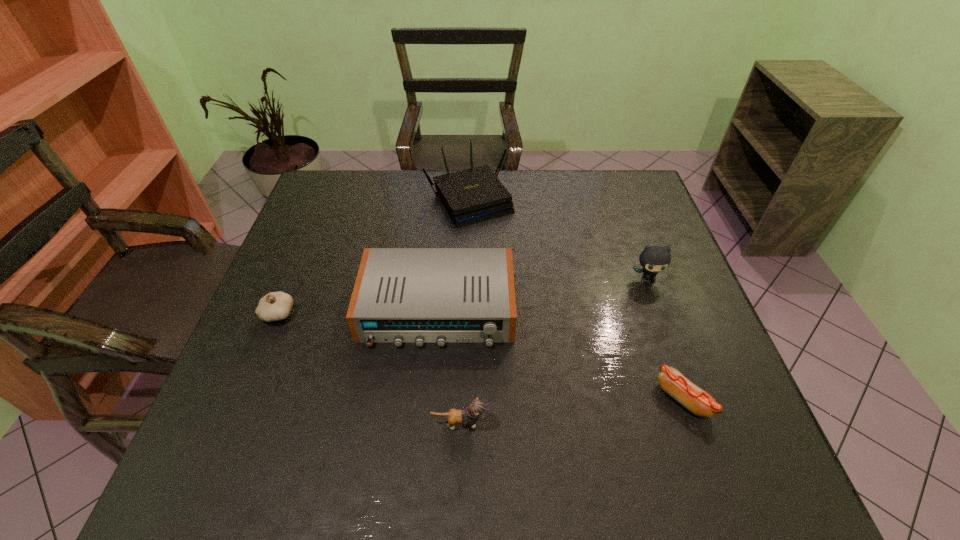
Identify the location of object that stands as the closest to the router. (419, 295).

Locate an element on the screen. The height and width of the screenshot is (540, 960). vacant region that satisfies the following two spatial constraints: 1. on the front panel of the radio receiver; 2. on the right side of the shortest object is located at coordinates (429, 399).

Find the location of `vacant region that satisfies the following two spatial constraints: 1. on the front panel of the radio receiver; 2. on the right side of the sausage`. vacant region that satisfies the following two spatial constraints: 1. on the front panel of the radio receiver; 2. on the right side of the sausage is located at coordinates (429, 399).

Where is `vacant space that satisfies the following two spatial constraints: 1. on the front side of the leftmost object; 2. on the left side of the shortest object`? The height and width of the screenshot is (540, 960). vacant space that satisfies the following two spatial constraints: 1. on the front side of the leftmost object; 2. on the left side of the shortest object is located at coordinates (244, 399).

Locate an element on the screen. vacant space that satisfies the following two spatial constraints: 1. on the front side of the shortest object; 2. on the right side of the router is located at coordinates (464, 399).